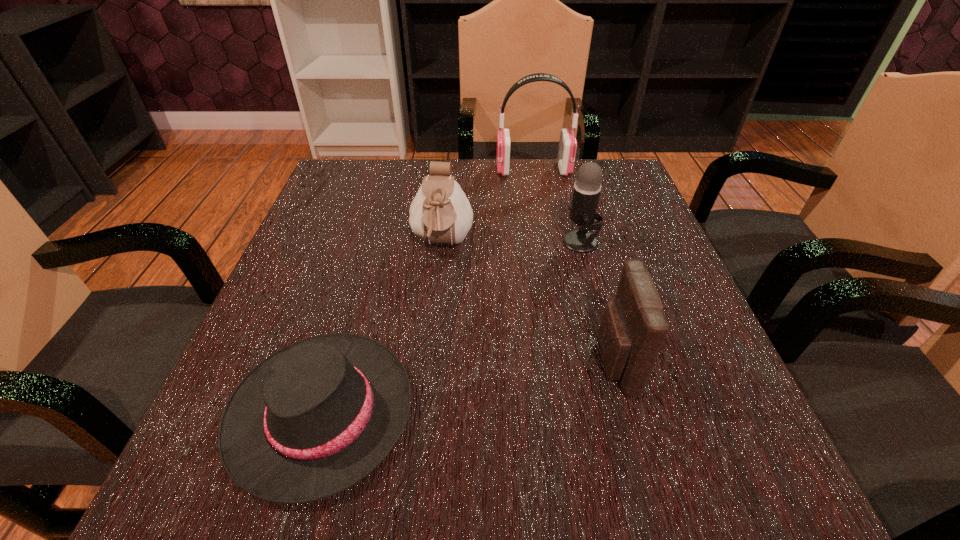
Select which object is the fourth closest to the dress hat. Please provide its 2D coordinates. Your answer should be formatted as a tuple, i.e. [(x, y)], where the tuple contains the x and y coordinates of a point satisfying the conditions above.

[(567, 148)]

Point out which object is positioned as the nearest to the farther pouch. Please provide its 2D coordinates. Your answer should be formatted as a tuple, i.e. [(x, y)], where the tuple contains the x and y coordinates of a point satisfying the conditions above.

[(314, 418)]

Where is `vacant region that satisfies the following two spatial constraints: 1. on the outer surface of the farthest object; 2. on the front-facing side of the farther pouch`? This screenshot has width=960, height=540. vacant region that satisfies the following two spatial constraints: 1. on the outer surface of the farthest object; 2. on the front-facing side of the farther pouch is located at coordinates (546, 245).

The height and width of the screenshot is (540, 960). In order to click on vacant space that satisfies the following two spatial constraints: 1. on the outer surface of the earphone; 2. on the left side of the microphone in this screenshot , I will do `click(546, 242)`.

Where is `free space in the image that satisfies the following two spatial constraints: 1. with an open flap on the right pouch; 2. on the front side of the shortest object`? free space in the image that satisfies the following two spatial constraints: 1. with an open flap on the right pouch; 2. on the front side of the shortest object is located at coordinates coord(628,413).